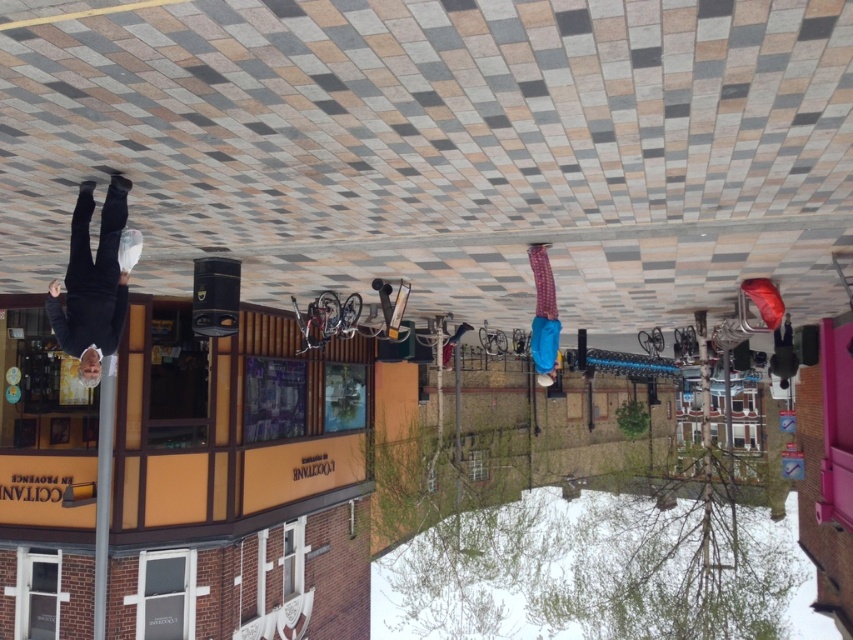
Consider the image. Who is more distant from viewer, (113, 240) or (535, 291)?

Positioned behind is point (535, 291).

Does point (117, 250) lie behind point (543, 314)?

No, (117, 250) is closer to viewer.

In order to click on black matte pants at left in this screenshot , I will do `click(91, 282)`.